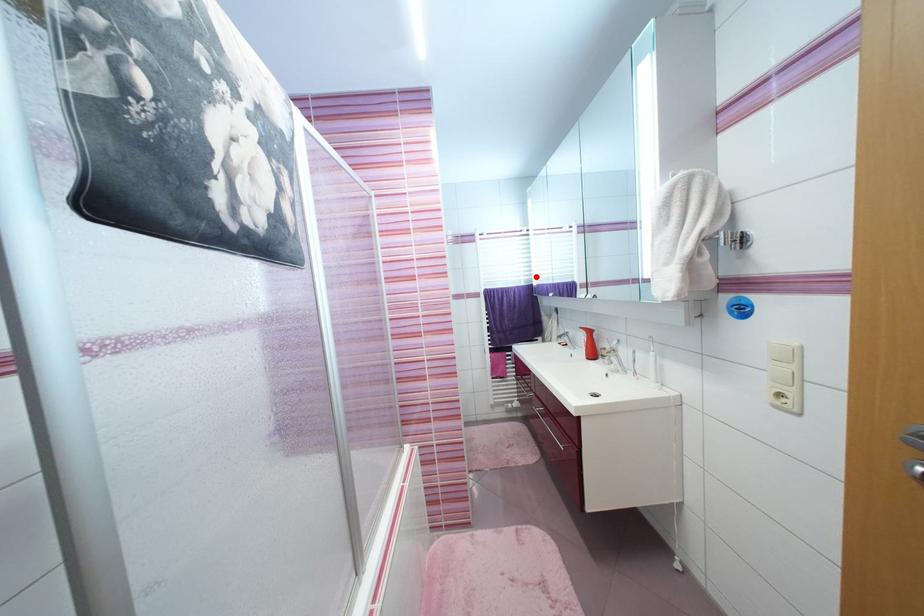
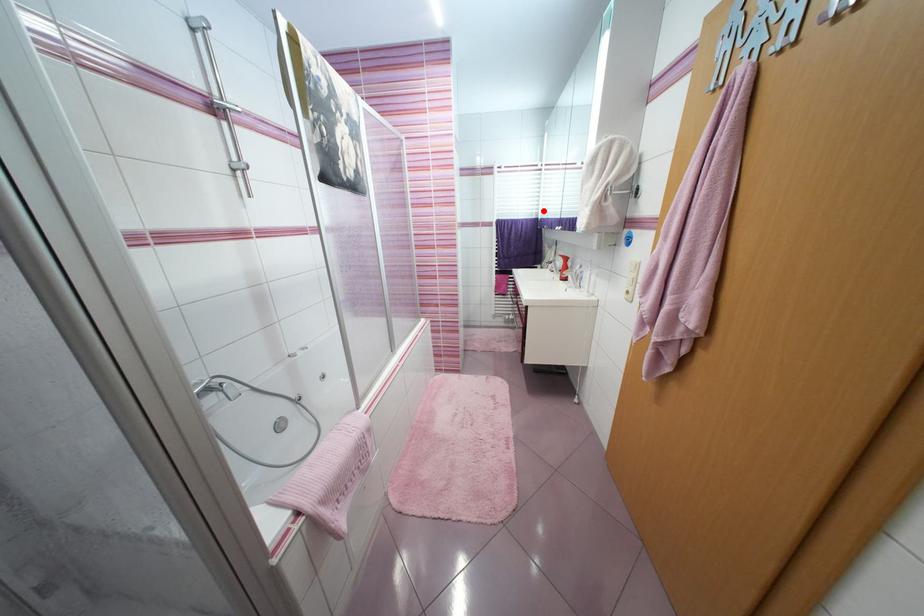
I am providing you with two images of the same scene from different viewpoints. A red point is marked on the first image and another point is marked on the second image. Does the point marked in image1 correspond to the same location as the one in image2?

Yes